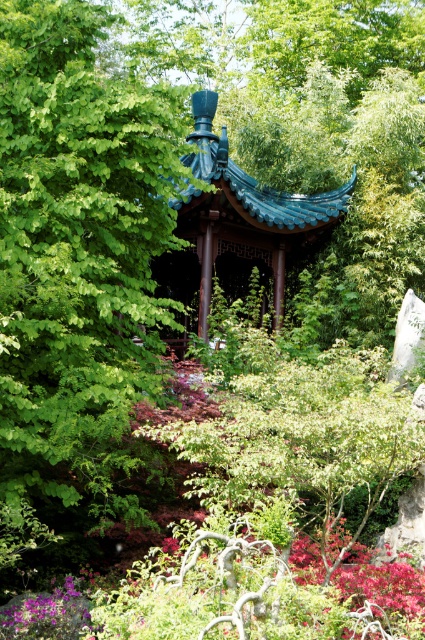
Question: Can you confirm if matte purple flower at center is bigger than teal glazed gazebo at center?

Choices:
 (A) no
 (B) yes

Answer: (A)

Question: Can you confirm if green glossy tree at center is positioned to the left of teal glazed gazebo at center?

Choices:
 (A) no
 (B) yes

Answer: (B)

Question: Can you confirm if green glossy tree at center is positioned below teal glazed gazebo at center?

Choices:
 (A) yes
 (B) no

Answer: (A)

Question: Considering the real-world distances, which object is farthest from the matte purple flower at center?

Choices:
 (A) teal glazed gazebo at center
 (B) green glossy tree at center

Answer: (A)

Question: Which point appears farthest from the camera in this image?

Choices:
 (A) (51, 10)
 (B) (374, 621)
 (C) (280, 294)

Answer: (C)

Question: Which point is farther to the camera?

Choices:
 (A) (31, 61)
 (B) (159, 276)

Answer: (B)